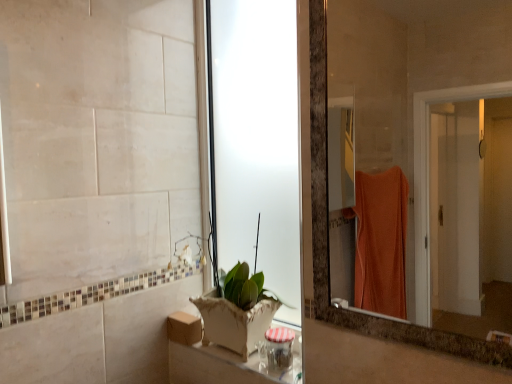
Question: Can you confirm if matte glass mirror at right is thinner than wooden box at lower center?

Choices:
 (A) yes
 (B) no

Answer: (A)

Question: Does matte glass mirror at right have a larger size compared to wooden box at lower center?

Choices:
 (A) yes
 (B) no

Answer: (A)

Question: Is matte glass mirror at right wider than wooden box at lower center?

Choices:
 (A) no
 (B) yes

Answer: (A)

Question: Considering the relative positions of matte glass mirror at right and wooden box at lower center in the image provided, is matte glass mirror at right in front of wooden box at lower center?

Choices:
 (A) no
 (B) yes

Answer: (B)

Question: Is matte glass mirror at right directly adjacent to wooden box at lower center?

Choices:
 (A) no
 (B) yes

Answer: (A)

Question: Is matte glass mirror at right further to camera compared to wooden box at lower center?

Choices:
 (A) no
 (B) yes

Answer: (A)

Question: From a real-world perspective, does transparent frosted glass door at center sit lower than white ceramic pot at lower center?

Choices:
 (A) yes
 (B) no

Answer: (B)

Question: Would you say transparent frosted glass door at center contains white ceramic pot at lower center?

Choices:
 (A) yes
 (B) no

Answer: (B)

Question: Is transparent frosted glass door at center positioned beyond the bounds of white ceramic pot at lower center?

Choices:
 (A) no
 (B) yes

Answer: (B)

Question: Is transparent frosted glass door at center oriented towards white ceramic pot at lower center?

Choices:
 (A) yes
 (B) no

Answer: (A)

Question: From the image's perspective, is transparent frosted glass door at center located beneath white ceramic pot at lower center?

Choices:
 (A) yes
 (B) no

Answer: (B)

Question: Can you confirm if transparent frosted glass door at center is wider than white ceramic pot at lower center?

Choices:
 (A) no
 (B) yes

Answer: (A)

Question: From a real-world perspective, is wooden box at lower center located beneath white ceramic pot at lower center?

Choices:
 (A) yes
 (B) no

Answer: (A)